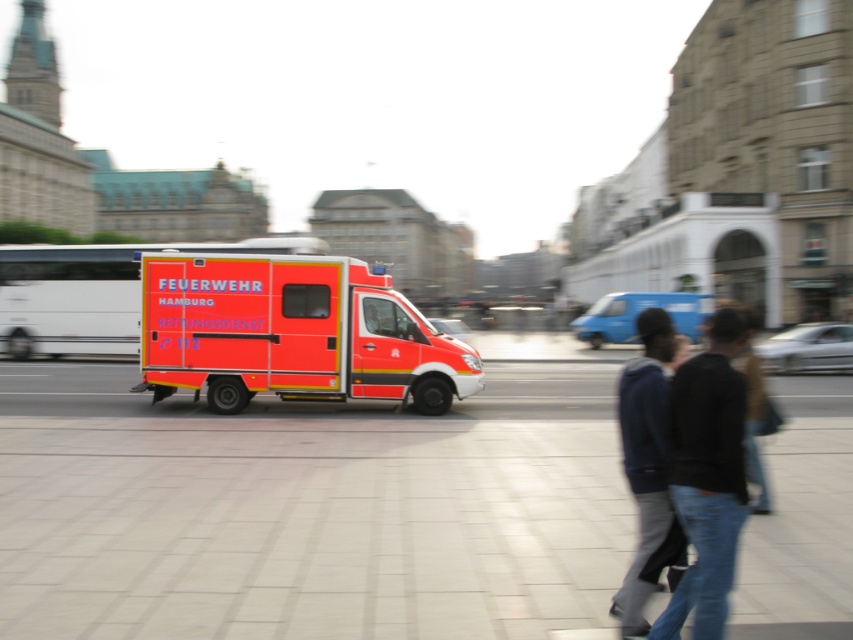
You are a drone operator trying to capture a photo of the FEUERWEHR HAMBURG RETTUNGSDIENST C 112 emergency vehicle. You need to ensure that both the point at coordinates point (161, 289) and point (732, 385) are visible in the frame. Which point should you focus on to ensure the emergency vehicle remains in focus?

You should focus on point (161, 289) because it is closer to the viewer than point (732, 385), ensuring the emergency vehicle stays in focus.

You are a pedestrian standing on the sidewalk and see the orange matte ambulance at center and the dark blue jacket at center. Which object is higher from the ground?

The orange matte ambulance at center is located above dark blue jacket at center, so the orange matte ambulance at center is higher from the ground.

You are a pedestrian standing at the edge of the street in Hamburg. You see the smooth concrete pavement at center and the dark blue jacket at center. Which object is located to the right of the other?

The smooth concrete pavement at center is to the right of the dark blue jacket at center.